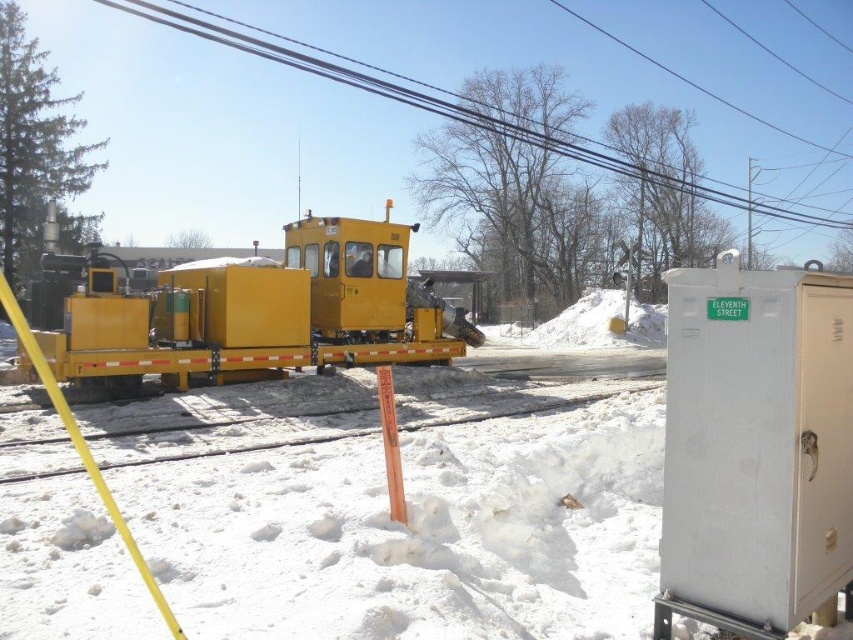
Based on the photo, you are a worker needing to store tools in the white metallic cabinet at right. You have a long smooth yellow cable at upper center that you need to place inside. Will the cable fit inside the cabinet?

The white metallic cabinet at right is smaller than the smooth yellow cable at upper center, so the cable will not fit inside the cabinet.

You are standing next to the white metallic cabinet at right and want to take a photo of the construction vehicle. The camera you have requires you to be within 10 feet to capture a clear image. Can you take a clear photo of the construction vehicle with your camera?

The white metallic cabinet at right and camera are 10.07 feet apart from each other. Since the camera requires being within 10 feet for a clear image, the distance is slightly over the limit. Therefore, you cannot take a clear photo of the construction vehicle with your camera.